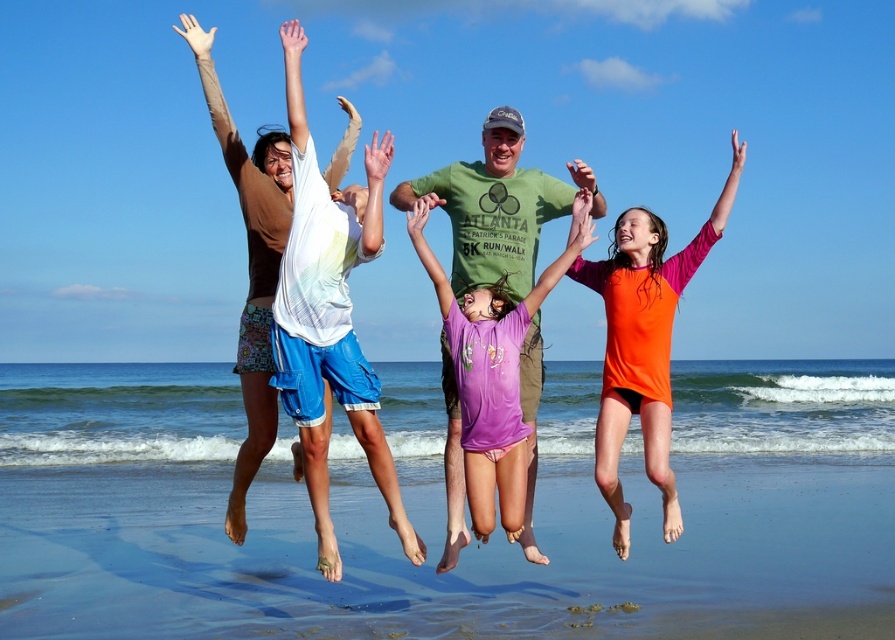
Question: Which point is farther to the camera?

Choices:
 (A) (411, 220)
 (B) (486, 456)

Answer: (B)

Question: Can you confirm if smooth sand at lower center is wider than matte white shirt at center?

Choices:
 (A) yes
 (B) no

Answer: (A)

Question: Which object is positioned farthest from the smooth sand at lower center?

Choices:
 (A) purple cotton shirt at center
 (B) matte white shirt at center
 (C) orange rash guard at center

Answer: (A)

Question: Which of the following is the farthest from the observer?

Choices:
 (A) (486, 298)
 (B) (649, 221)
 (C) (640, 365)

Answer: (C)

Question: Does matte white shirt at center appear under orange rash guard at center?

Choices:
 (A) no
 (B) yes

Answer: (A)

Question: Does smooth sand at lower center appear under purple cotton shirt at center?

Choices:
 (A) yes
 (B) no

Answer: (A)